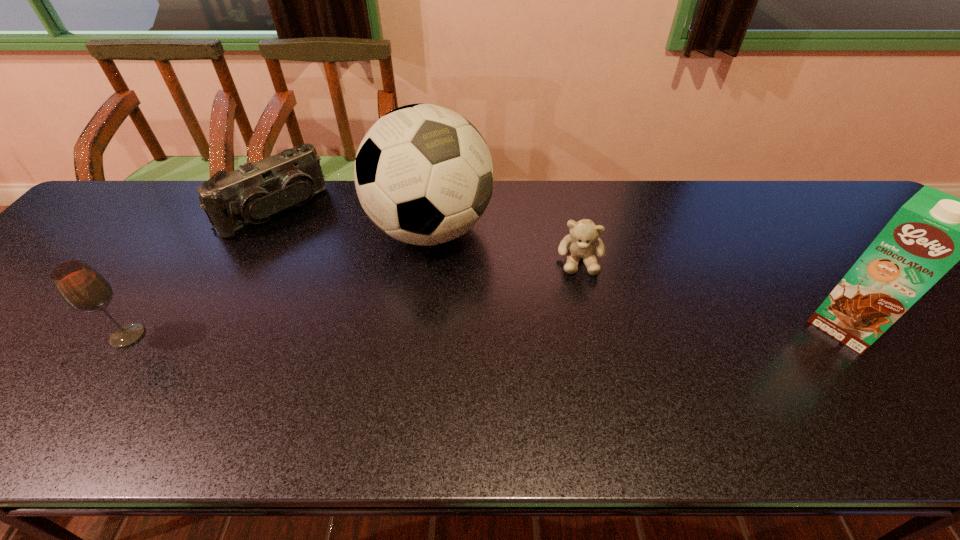
At what (x,y) coordinates should I click in order to perform the action: click on empty space between the third tallest object and the second object from right to left. Please return your answer as a coordinate pair (x, y). The height and width of the screenshot is (540, 960). Looking at the image, I should click on (354, 298).

Locate an element on the screen. The height and width of the screenshot is (540, 960). free space between the rightmost object and the camcorder is located at coordinates (560, 268).

This screenshot has height=540, width=960. I want to click on vacant point located between the carton and the glass drink container, so click(487, 330).

Identify which object is the second closest to the third tallest object. Please provide its 2D coordinates. Your answer should be formatted as a tuple, i.e. [(x, y)], where the tuple contains the x and y coordinates of a point satisfying the conditions above.

[(423, 173)]

At what (x,y) coordinates should I click in order to perform the action: click on the second closest object relative to the camcorder. Please return your answer as a coordinate pair (x, y). Image resolution: width=960 pixels, height=540 pixels. Looking at the image, I should click on (80, 286).

The image size is (960, 540). Find the location of `free space that satisfies the following two spatial constraints: 1. on the back side of the third tallest object; 2. on the right side of the fourth object from left to right`. free space that satisfies the following two spatial constraints: 1. on the back side of the third tallest object; 2. on the right side of the fourth object from left to right is located at coordinates (180, 260).